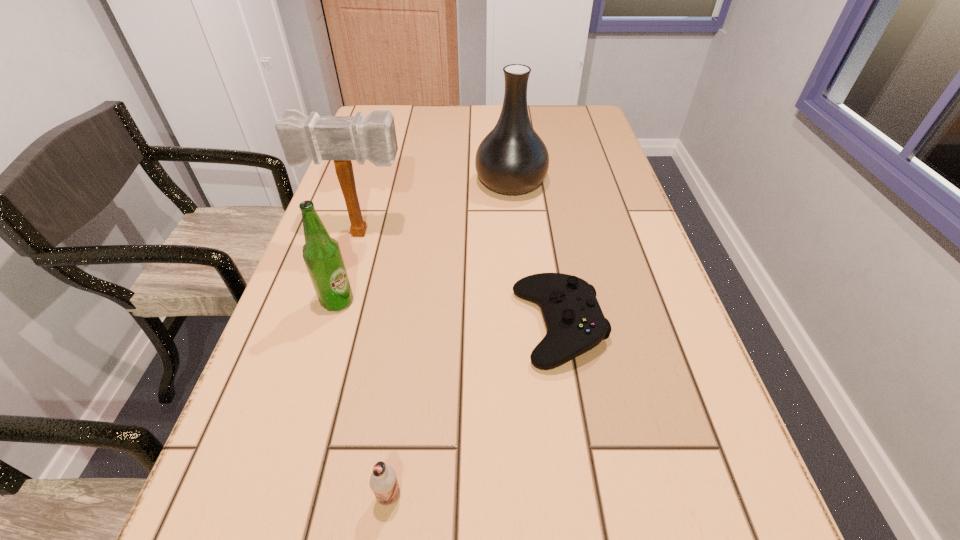
The width and height of the screenshot is (960, 540). Find the location of `vacant space that satisfies the following two spatial constraints: 1. on the label of the third tallest object; 2. on the back side of the shortest object`. vacant space that satisfies the following two spatial constraints: 1. on the label of the third tallest object; 2. on the back side of the shortest object is located at coordinates (330, 326).

Identify the location of free spot that satisfies the following two spatial constraints: 1. on the label of the fourth tallest object; 2. on the right side of the beer bottle. The width and height of the screenshot is (960, 540). (278, 496).

Find the location of a particular element. The height and width of the screenshot is (540, 960). free location that satisfies the following two spatial constraints: 1. on the label of the beer bottle; 2. on the back side of the nearest object is located at coordinates (278, 496).

At what (x,y) coordinates should I click in order to perform the action: click on free space that satisfies the following two spatial constraints: 1. on the front side of the farthest object; 2. on the left side of the shortest object. Please return your answer as a coordinate pair (x, y). Looking at the image, I should click on (523, 326).